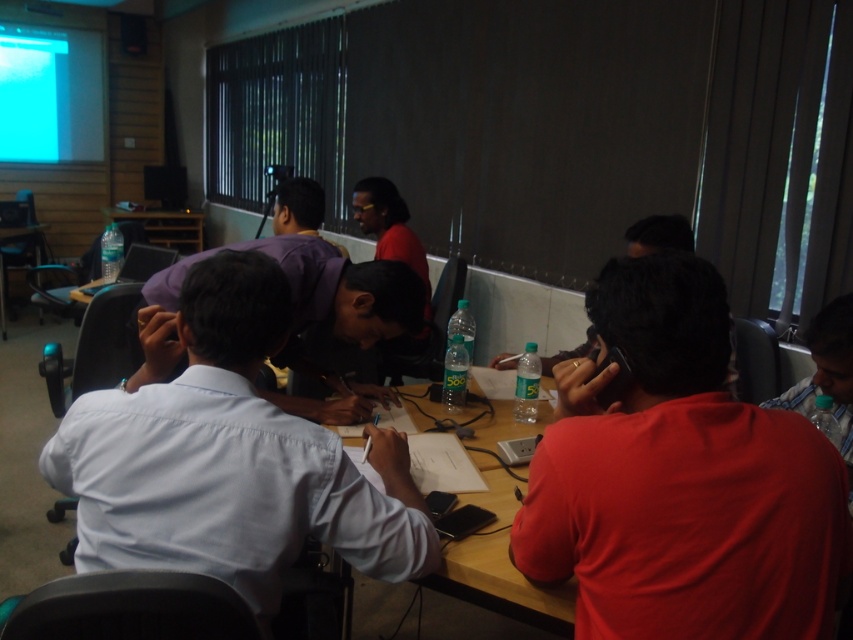
You are standing at the entrance of the conference room and want to locate the white cotton shirt at center. According to the coordinates provided, where should you look?

You should look at point (230, 458) to find the white cotton shirt at center.

You are a photographer standing at the back of the room. You want to take a photo of the red matte shirt at right and the wooden table at center. Based on their heights, which object will appear larger in the photo?

The red matte shirt at right is taller than the wooden table at center, so it will appear larger in the photo.

Looking at this image, you are standing in the conference room and want to determine which of the two points, point (93,444) or point (192,227), is nearer to you. Can you figure out which one is closer?

Point (93,444) is closer to the viewer than point (192,227).